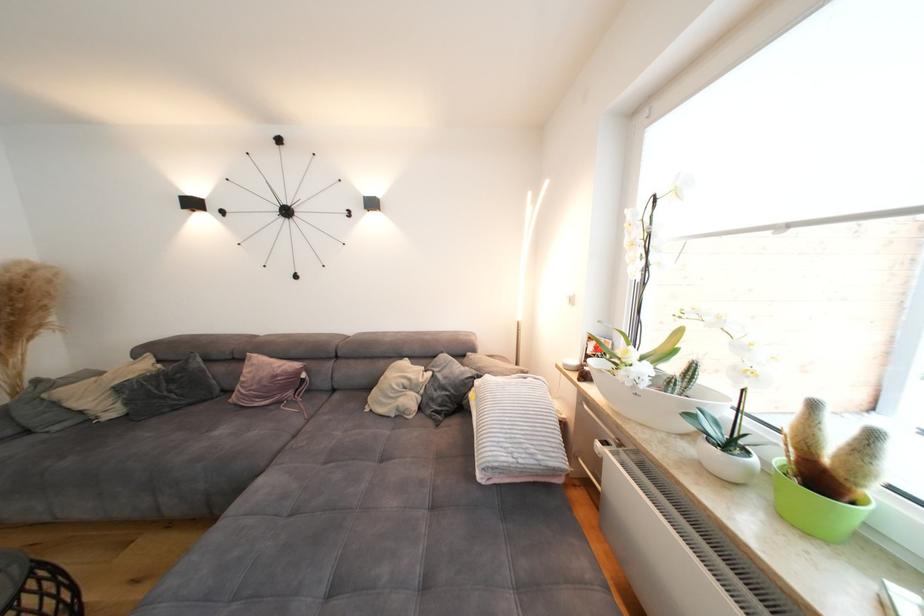
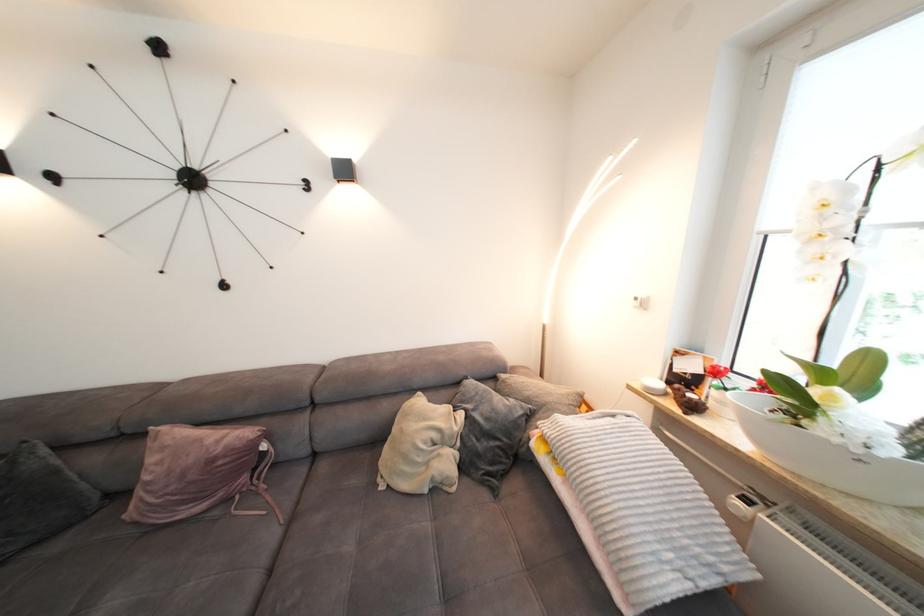
Locate, in the second image, the point that corresponds to the point at 225,391 in the first image.

(103, 498)